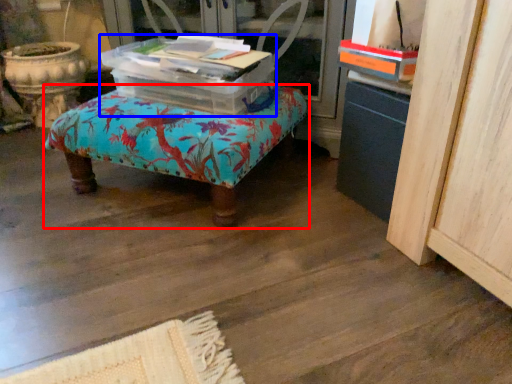
Question: Which point is closer to the camera, furniture (highlighted by a red box) or storage box (highlighted by a blue box)?

Choices:
 (A) furniture
 (B) storage box

Answer: (A)